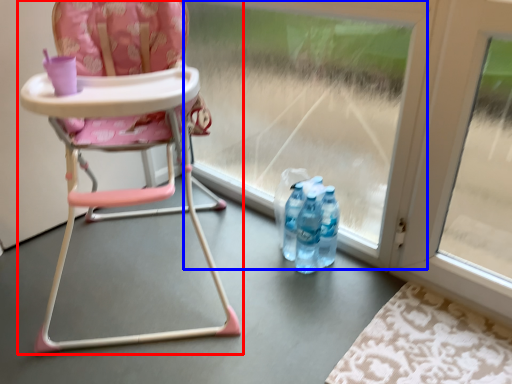
Question: Which object is further to the camera taking this photo, chair (highlighted by a red box) or glass door (highlighted by a blue box)?

Choices:
 (A) chair
 (B) glass door

Answer: (B)